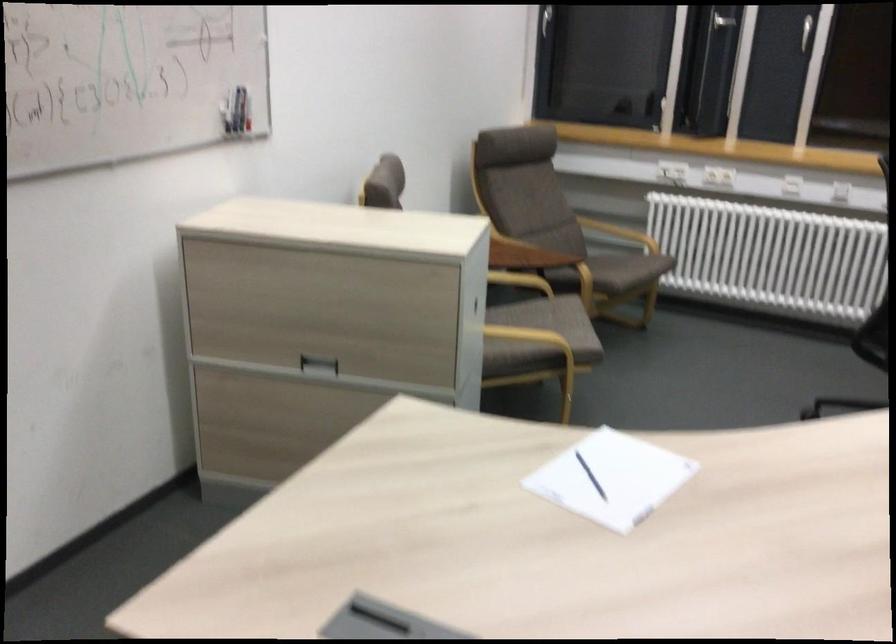
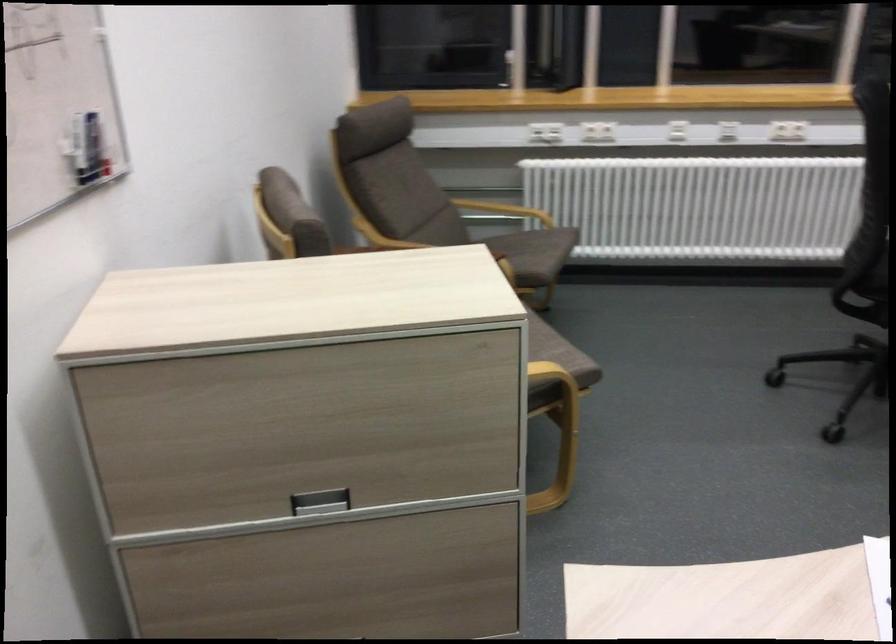
Question: Based on the continuous images, in which direction is the camera rotating? Reply with the corresponding letter.

Choices:
 (A) Left
 (B) Right
 (C) Up
 (D) Down

Answer: (B)